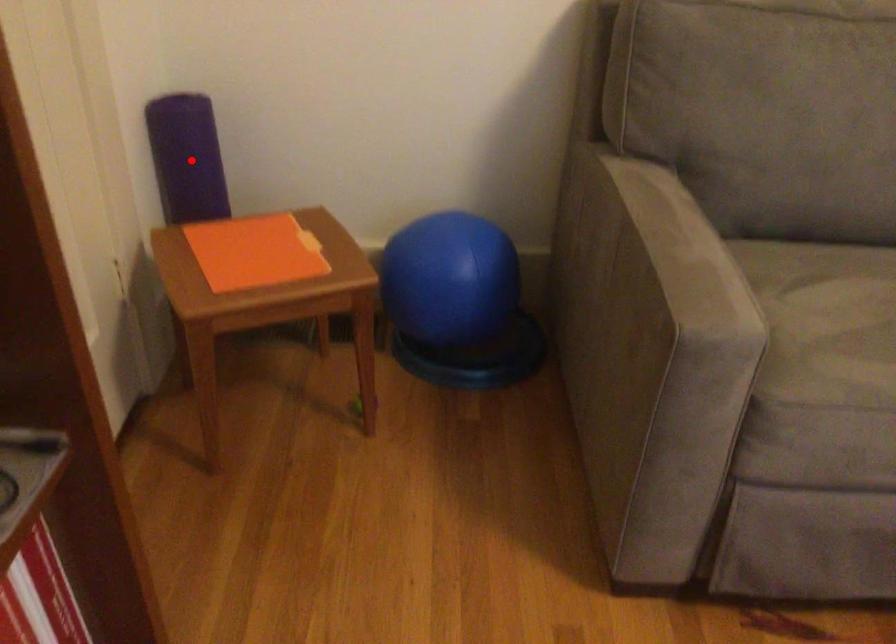
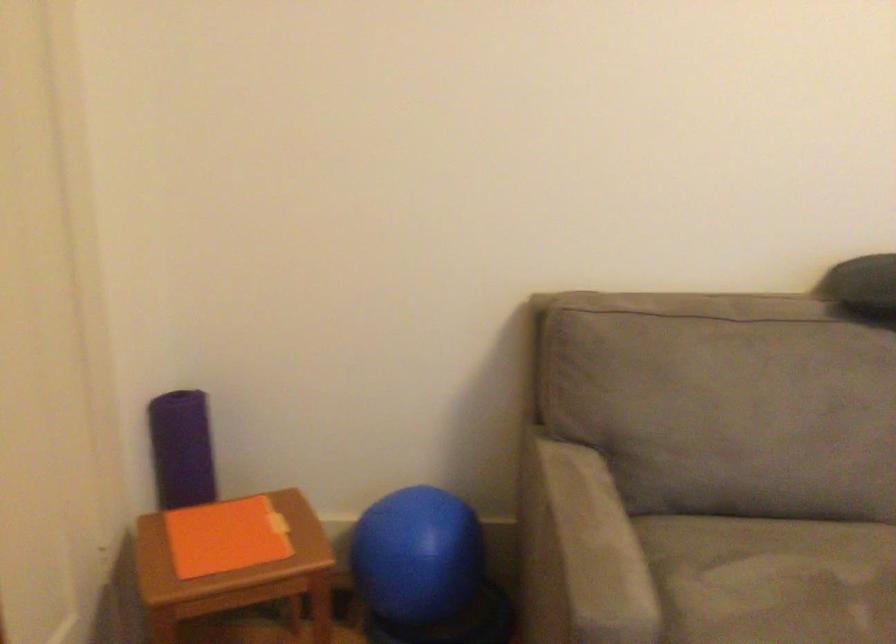
Question: I am providing you with two images of the same scene from different viewpoints. In image1, a red point is highlighted. Considering the same 3D point in image2, which of the following is correct?

Choices:
 (A) It is closer
 (B) It is farther

Answer: (B)